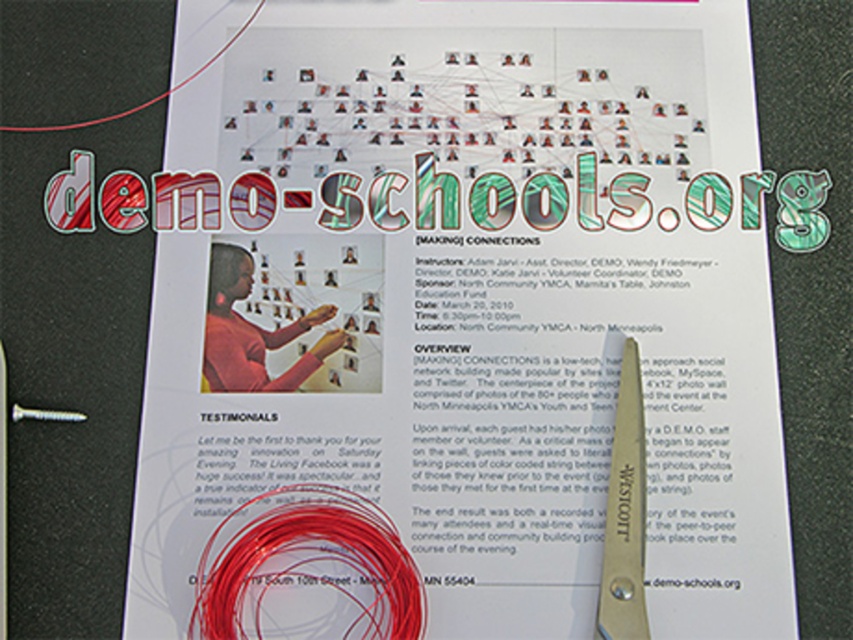
Which is more to the left, red string at center or silver metallic scissors at lower right?

red string at center is more to the left.

Can you confirm if red string at center is positioned above silver metallic scissors at lower right?

Incorrect, red string at center is not positioned above silver metallic scissors at lower right.

Locate an element on the screen. The height and width of the screenshot is (640, 853). red string at center is located at coordinates (306, 572).

The height and width of the screenshot is (640, 853). I want to click on red string at center, so click(x=306, y=572).